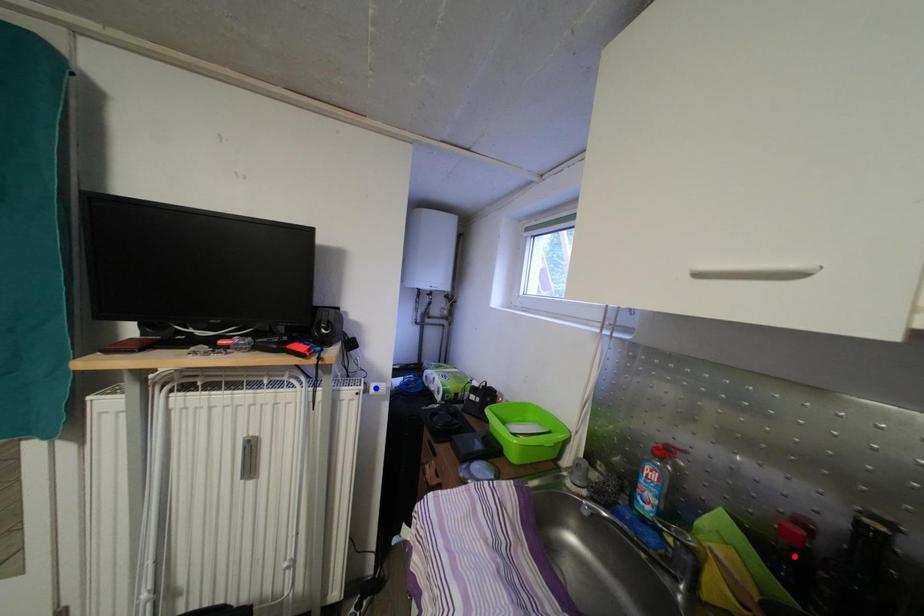
Question: Which of the two points in the image is closer to the camera?

Choices:
 (A) Blue point is closer.
 (B) Red point is closer.

Answer: (B)